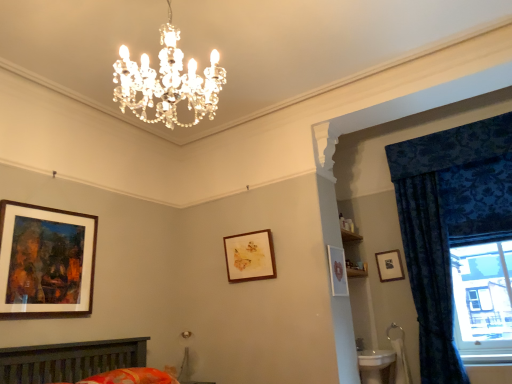
Question: From their relative heights in the image, would you say matte black picture frame at upper right, marked as the fourth picture frame in a left-to-right arrangement, is taller or shorter than matte white picture frame at center-right, which appears as the second picture frame when viewed from the right?

Choices:
 (A) short
 (B) tall

Answer: (A)

Question: Is matte black picture frame at upper right, the 4th picture frame in the front-to-back sequence, wider or thinner than matte white picture frame at center-right, placed as the 3th picture frame when sorted from back to front?

Choices:
 (A) thin
 (B) wide

Answer: (B)

Question: Estimate the real-world distances between objects in this image. Which object is closer to the matte black picture frame at upper right, the first picture frame positioned from the right?

Choices:
 (A) velvet blue curtain at right, acting as the 2th curtain starting from the right
 (B) matte white picture frame at center-right, which appears as the second picture frame when viewed from the right
 (C) wooden-framed painting at left, which ranks as the fourth picture frame in right-to-left order
 (D) floral cotton bedspread at lower center
 (E) wooden picture frame at center, the 2th picture frame from the back

Answer: (A)

Question: Considering the real-world distances, which object is closest to the velvet blue curtain at right, acting as the 2th curtain starting from the right?

Choices:
 (A) matte white picture frame at center-right, positioned as the 2th picture frame in front-to-back order
 (B) wooden picture frame at center, placed as the 3th picture frame when sorted from front to back
 (C) matte black picture frame at upper right, which is the 1th picture frame from back to front
 (D) blue velvet curtain at right, the first curtain when ordered from right to left
 (E) wooden-framed painting at left, positioned as the 1th picture frame in front-to-back order

Answer: (D)